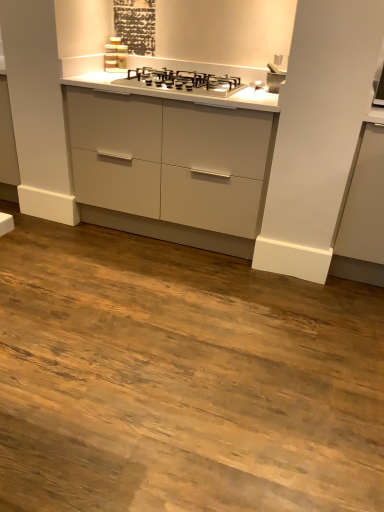
Measure the distance between satin silver faucet at upper right and camera.

They are 7.42 feet apart.

Where is `matte gray cabinet at right`? The width and height of the screenshot is (384, 512). matte gray cabinet at right is located at coordinates (365, 203).

Is satin silver gas stove at center facing towards matte gray cabinet at right?

No, satin silver gas stove at center is not turned towards matte gray cabinet at right.

Considering the sizes of objects satin silver gas stove at center and matte gray cabinet at right in the image provided, who is bigger, satin silver gas stove at center or matte gray cabinet at right?

With larger size is matte gray cabinet at right.

From the image's perspective, is satin silver gas stove at center located above or below matte gray cabinet at right?

satin silver gas stove at center is situated higher than matte gray cabinet at right in the image.

Between satin silver gas stove at center and matte gray cabinet at right, which one has more height?

matte gray cabinet at right.

From the image's perspective, is matte gray cabinet at right over satin silver faucet at upper right?

No, from the image's perspective, matte gray cabinet at right is not over satin silver faucet at upper right.

At what (x,y) coordinates should I click in order to perform the action: click on sink that is above the matte gray cabinet at right (from a real-world perspective). Please return your answer as a coordinate pair (x, y). The width and height of the screenshot is (384, 512). Looking at the image, I should click on (274, 78).

Between matte gray cabinet at right and satin silver faucet at upper right, which one has smaller width?

satin silver faucet at upper right.

Is point (342, 245) closer or farther from the camera than point (270, 87)?

Point (342, 245) is positioned closer to the camera compared to point (270, 87).

Is satin silver gas stove at center positioned far away from satin silver faucet at upper right?

No, satin silver gas stove at center is not far from satin silver faucet at upper right.

Considering the relative positions of satin silver gas stove at center and satin silver faucet at upper right in the image provided, is satin silver gas stove at center in front of satin silver faucet at upper right?

Yes, satin silver gas stove at center is in front of satin silver faucet at upper right.

Is satin silver gas stove at center surrounding satin silver faucet at upper right?

Actually, satin silver faucet at upper right is outside satin silver gas stove at center.

Which is in front, point (369, 239) or point (194, 87)?

The point (369, 239) is more forward.

Is matte gray cabinet at right beside satin silver gas stove at center?

No, matte gray cabinet at right is not beside satin silver gas stove at center.

Considering the relative sizes of matte gray cabinet at right and satin silver gas stove at center in the image provided, is matte gray cabinet at right smaller than satin silver gas stove at center?

No, matte gray cabinet at right is not smaller than satin silver gas stove at center.

How distant is matte gray cabinet at right from satin silver gas stove at center?

matte gray cabinet at right is 37.74 inches away from satin silver gas stove at center.

This screenshot has height=512, width=384. In order to click on gas stove below the satin silver faucet at upper right (from a real-world perspective) in this screenshot , I will do `click(182, 81)`.

Considering the sizes of objects satin silver faucet at upper right and satin silver gas stove at center in the image provided, who is wider, satin silver faucet at upper right or satin silver gas stove at center?

With larger width is satin silver gas stove at center.

Does satin silver faucet at upper right appear on the right side of satin silver gas stove at center?

Yes.

From a real-world perspective, which object stands above the other?

satin silver faucet at upper right is physically above.

Would you say satin silver faucet at upper right is inside or outside matte gray cabinet at right?

The correct answer is: outside.

Is point (277, 85) closer to viewer compared to point (346, 231)?

No, (277, 85) is further to viewer.

Is satin silver faucet at upper right thinner than matte gray cabinet at right?

Correct, the width of satin silver faucet at upper right is less than that of matte gray cabinet at right.

In the scene shown: What's the angular difference between satin silver faucet at upper right and matte gray cabinet at right's facing directions?

2.03 degrees.

Identify the location of cabinetry below the satin silver gas stove at center (from a real-world perspective). The width and height of the screenshot is (384, 512). (365, 203).

Where is `sink that is above the matte gray cabinet at right (from a real-world perspective)`? sink that is above the matte gray cabinet at right (from a real-world perspective) is located at coordinates (274, 78).

Based on their spatial positions, is satin silver gas stove at center or matte gray cabinet at right closer to satin silver faucet at upper right?

satin silver gas stove at center is closer to satin silver faucet at upper right.

In the scene shown: When comparing their distances from satin silver faucet at upper right, does matte gray cabinet at right or satin silver gas stove at center seem further?

Among the two, matte gray cabinet at right is located further to satin silver faucet at upper right.

Estimate the real-world distances between objects in this image. Which object is further from satin silver gas stove at center, satin silver faucet at upper right or matte gray cabinet at right?

matte gray cabinet at right is positioned further to the anchor satin silver gas stove at center.

From the image, which object appears to be farther from matte gray cabinet at right, satin silver faucet at upper right or satin silver gas stove at center?

The object further to matte gray cabinet at right is satin silver gas stove at center.

Looking at the image, which one is located closer to matte gray cabinet at right, satin silver gas stove at center or satin silver faucet at upper right?

The object closer to matte gray cabinet at right is satin silver faucet at upper right.

Looking at the image, which one is located closer to satin silver gas stove at center, matte gray cabinet at right or satin silver faucet at upper right?

satin silver faucet at upper right.

The height and width of the screenshot is (512, 384). Find the location of `sink between satin silver gas stove at center and matte gray cabinet at right`. sink between satin silver gas stove at center and matte gray cabinet at right is located at coordinates (274, 78).